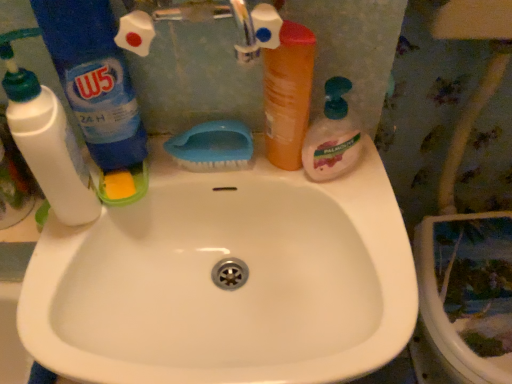
Question: From a real-world perspective, is blue plastic bottle at left, which is counted as the second cleaning product, starting from the right, physically below translucent plastic soap dispenser at right, acting as the first cleaning product starting from the right?

Choices:
 (A) yes
 (B) no

Answer: (B)

Question: Considering the relative sizes of blue plastic bottle at left, which is counted as the second cleaning product, starting from the right, and translucent plastic soap dispenser at right, which ranks as the third cleaning product in left-to-right order, in the image provided, is blue plastic bottle at left, which is counted as the second cleaning product, starting from the right, bigger than translucent plastic soap dispenser at right, which ranks as the third cleaning product in left-to-right order,?

Choices:
 (A) no
 (B) yes

Answer: (B)

Question: From the image's perspective, does blue plastic bottle at left, which is counted as the second cleaning product, starting from the right, appear higher than translucent plastic soap dispenser at right, acting as the first cleaning product starting from the right?

Choices:
 (A) yes
 (B) no

Answer: (A)

Question: Does blue plastic bottle at left, the second cleaning product positioned from the left, appear on the right side of translucent plastic soap dispenser at right, acting as the first cleaning product starting from the right?

Choices:
 (A) no
 (B) yes

Answer: (A)

Question: Are blue plastic bottle at left, the second cleaning product positioned from the left, and translucent plastic soap dispenser at right, which ranks as the third cleaning product in left-to-right order, beside each other?

Choices:
 (A) no
 (B) yes

Answer: (A)

Question: From a real-world perspective, is blue plastic brush at upper center above or below translucent plastic soap dispenser at right, acting as the first cleaning product starting from the right?

Choices:
 (A) below
 (B) above

Answer: (A)

Question: In the image, is blue plastic brush at upper center positioned in front of or behind translucent plastic soap dispenser at right, acting as the first cleaning product starting from the right?

Choices:
 (A) behind
 (B) front

Answer: (A)

Question: Considering the positions of point (226, 132) and point (315, 148), is point (226, 132) closer or farther from the camera than point (315, 148)?

Choices:
 (A) closer
 (B) farther

Answer: (B)

Question: Is blue plastic brush at upper center situated inside translucent plastic soap dispenser at right, which ranks as the third cleaning product in left-to-right order, or outside?

Choices:
 (A) outside
 (B) inside

Answer: (A)

Question: From a real-world perspective, is blue plastic brush at upper center physically located above or below orange matte bottle at upper center?

Choices:
 (A) below
 (B) above

Answer: (A)

Question: In terms of height, does blue plastic brush at upper center look taller or shorter compared to orange matte bottle at upper center?

Choices:
 (A) short
 (B) tall

Answer: (A)

Question: In the image, is blue plastic brush at upper center on the left side or the right side of orange matte bottle at upper center?

Choices:
 (A) left
 (B) right

Answer: (A)

Question: Based on their sizes in the image, would you say blue plastic brush at upper center is bigger or smaller than orange matte bottle at upper center?

Choices:
 (A) small
 (B) big

Answer: (A)

Question: From a real-world perspective, is blue plastic bottle at left, the second cleaning product positioned from the left, positioned above or below blue plastic brush at upper center?

Choices:
 (A) below
 (B) above

Answer: (B)

Question: Choose the correct answer: Is blue plastic bottle at left, the second cleaning product positioned from the left, inside blue plastic brush at upper center or outside it?

Choices:
 (A) outside
 (B) inside

Answer: (A)